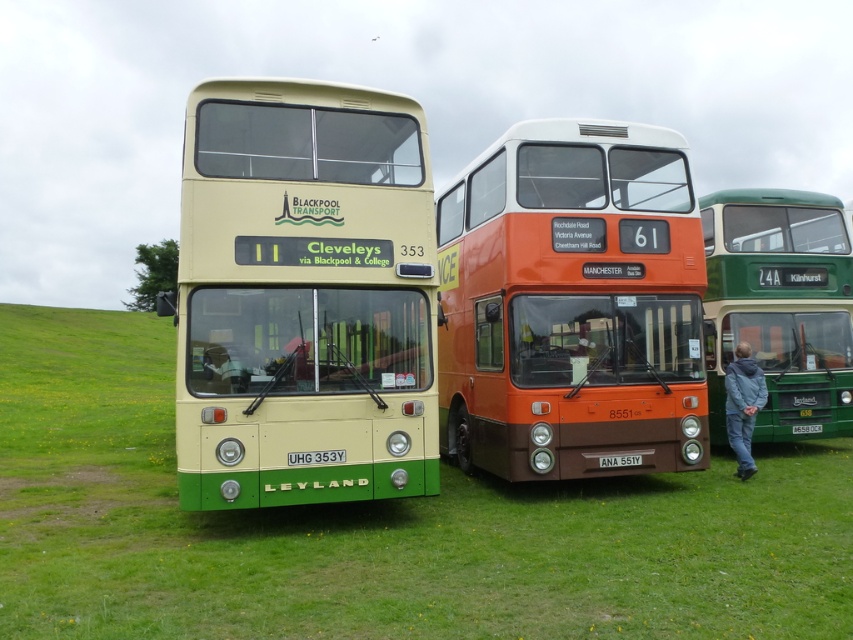
Does matte cream leyland bus at center lie in front of green matte bus at center?

That is True.

Who is shorter, matte cream leyland bus at center or green matte bus at center?

matte cream leyland bus at center

Locate an element on the screen. matte cream leyland bus at center is located at coordinates pyautogui.click(x=303, y=296).

Between green matte bus at center and green matte license plate at center, which one is positioned higher?

green matte bus at center is higher up.

Which is more to the right, green matte bus at center or green matte license plate at center?

Positioned to the right is green matte license plate at center.

Does point (840, 216) lie in front of point (798, 424)?

No, it is not.

This screenshot has width=853, height=640. What are the coordinates of `green matte bus at center` in the screenshot? It's located at (780, 305).

Does gray fabric jacket at lower right have a lesser height compared to red plastic license plate at center?

No, gray fabric jacket at lower right is not shorter than red plastic license plate at center.

Who is taller, gray fabric jacket at lower right or red plastic license plate at center?

gray fabric jacket at lower right

The width and height of the screenshot is (853, 640). Find the location of `gray fabric jacket at lower right`. gray fabric jacket at lower right is located at coordinates (743, 404).